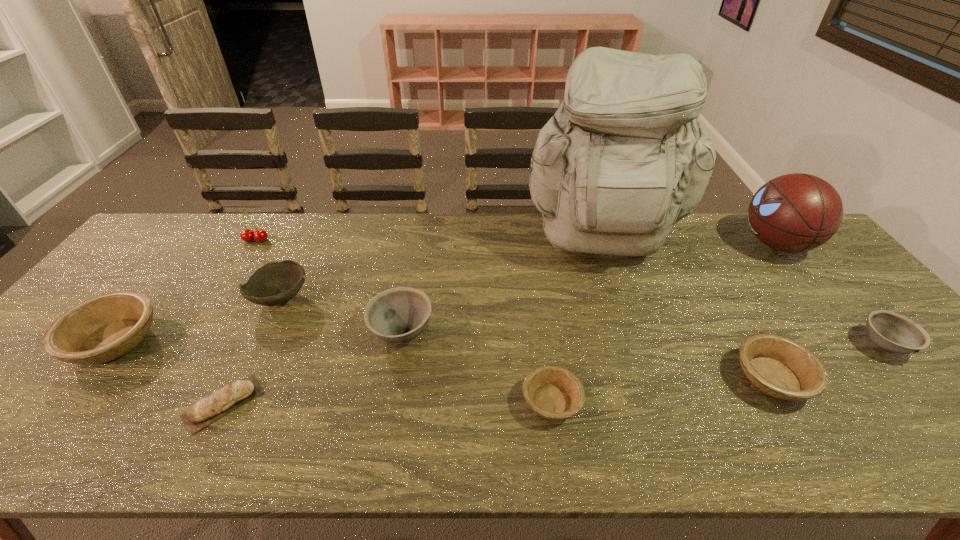
Where is `pita bread that is positioned at the near edge`? This screenshot has height=540, width=960. pita bread that is positioned at the near edge is located at coordinates (219, 403).

The height and width of the screenshot is (540, 960). I want to click on object located at the left edge, so click(103, 328).

You are a GUI agent. You are given a task and a screenshot of the screen. Output one action in this format:
    pyautogui.click(x=<x>, y=<y>)
    Task: Click on the basketball located at the right edge
    
    Given the screenshot: What is the action you would take?
    pyautogui.click(x=797, y=212)

Where is `bowl that is at the right edge`? The width and height of the screenshot is (960, 540). bowl that is at the right edge is located at coordinates (893, 332).

Locate an element on the screen. The height and width of the screenshot is (540, 960). object located in the far right corner section of the desktop is located at coordinates (797, 212).

At what (x,y) coordinates should I click in order to perform the action: click on vacant space at the far edge of the desktop. Please return your answer as a coordinate pair (x, y). The image size is (960, 540). Looking at the image, I should click on (377, 215).

Locate an element on the screen. vacant space at the near edge of the desktop is located at coordinates (895, 453).

Where is `vacant point at the left edge`? vacant point at the left edge is located at coordinates (152, 273).

Identify the location of vacant region at the far left corner of the desktop. (177, 213).

Image resolution: width=960 pixels, height=540 pixels. I want to click on free area in between the sixth object from right to left and the biggest beige bowl, so coord(258,337).